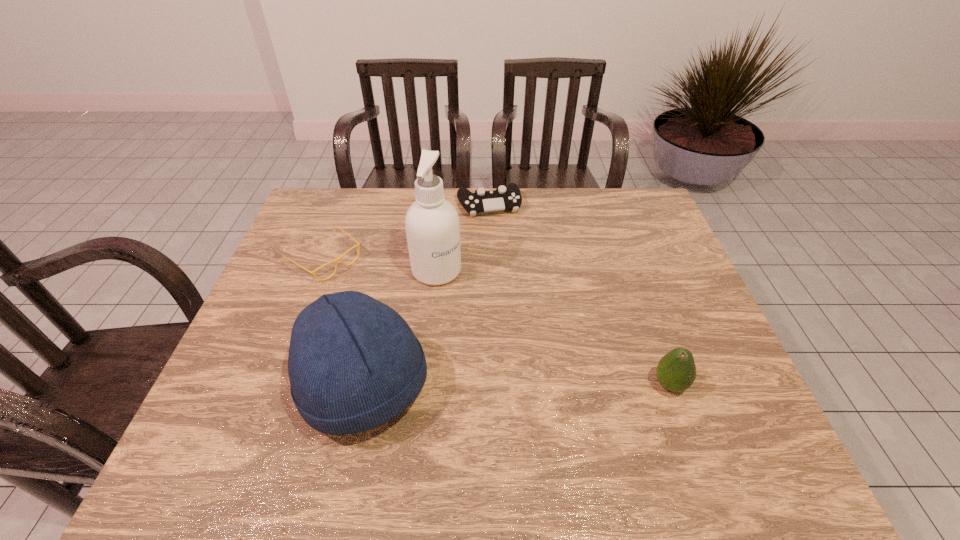
Locate an element on the screen. This screenshot has height=540, width=960. vacant space on the desktop that is between the skullcap and the avocado and is positioned on the front label of the tallest object is located at coordinates (562, 386).

At what (x,y) coordinates should I click in order to perform the action: click on free spot on the desktop that is between the fourth shortest object and the rightmost object and is positioned on the surface of the second shortest object. Please return your answer as a coordinate pair (x, y). The width and height of the screenshot is (960, 540). Looking at the image, I should click on (547, 386).

Find the location of `vacant spot on the desktop that is between the second tallest object and the third shortest object and is positioned in front of the lenses of the shortest object`. vacant spot on the desktop that is between the second tallest object and the third shortest object and is positioned in front of the lenses of the shortest object is located at coordinates (501, 386).